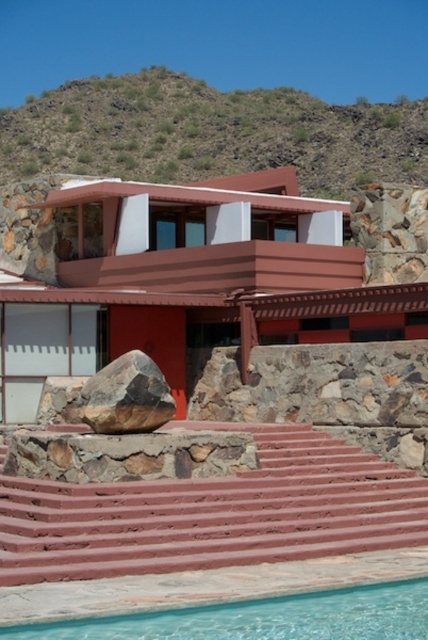
Question: Which object is farther from the camera taking this photo?

Choices:
 (A) smooth terracotta stairs at center
 (B) clear glass pool at lower center
 (C) green grassy hillside at upper center
 (D) matte red stone villa at center

Answer: (C)

Question: Which of the following is the farthest from the observer?

Choices:
 (A) (53, 636)
 (B) (395, 513)

Answer: (B)

Question: Does green grassy hillside at upper center appear on the right side of clear glass pool at lower center?

Choices:
 (A) no
 (B) yes

Answer: (A)

Question: Is clear glass pool at lower center to the left of brown rough rock at lower center from the viewer's perspective?

Choices:
 (A) yes
 (B) no

Answer: (B)

Question: Which of the following is the farthest from the observer?

Choices:
 (A) (380, 484)
 (B) (127, 80)

Answer: (B)

Question: Does matte red stone villa at center appear over green grassy hillside at upper center?

Choices:
 (A) no
 (B) yes

Answer: (A)